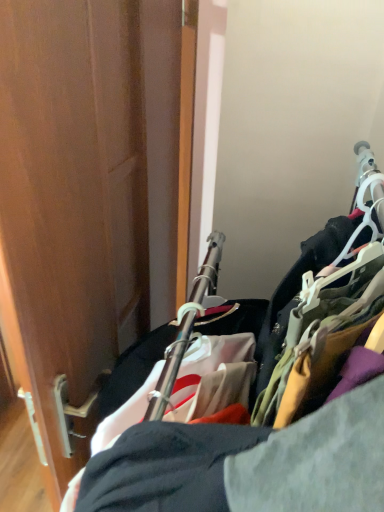
Where is `cloth hangers at right`? cloth hangers at right is located at coordinates (252, 375).

Image resolution: width=384 pixels, height=512 pixels. Describe the element at coordinates (252, 375) in the screenshot. I see `cloth hangers at right` at that location.

At what (x,y) coordinates should I click in order to perform the action: click on wooden door at left. Please return your answer as a coordinate pair (x, y). The image size is (384, 512). Looking at the image, I should click on (87, 195).

This screenshot has width=384, height=512. What do you see at coordinates (87, 195) in the screenshot? I see `wooden door at left` at bounding box center [87, 195].

Locate an element on the screen. cloth hangers at right is located at coordinates (252, 375).

Which is more to the right, cloth hangers at right or wooden door at left?

cloth hangers at right.

Does cloth hangers at right lie behind wooden door at left?

No, it is in front of wooden door at left.

Does point (351, 340) come in front of point (39, 295)?

Yes, point (351, 340) is in front of point (39, 295).

Looking at this image, from the image's perspective, is cloth hangers at right over wooden door at left?

No, from the image's perspective, cloth hangers at right is not over wooden door at left.

Consider the image. From a real-world perspective, is cloth hangers at right physically located above or below wooden door at left?

cloth hangers at right is situated lower than wooden door at left in the real world.

From the picture: Does cloth hangers at right have a greater width compared to wooden door at left?

Correct, the width of cloth hangers at right exceeds that of wooden door at left.

Which of these two, cloth hangers at right or wooden door at left, stands shorter?

wooden door at left is shorter.

Can you confirm if cloth hangers at right is smaller than wooden door at left?

No, cloth hangers at right is not smaller than wooden door at left.

Is wooden door at left surrounded by cloth hangers at right?

Definitely not — wooden door at left is not inside cloth hangers at right.

Are cloth hangers at right and wooden door at left far apart?

No, there isn't a large distance between cloth hangers at right and wooden door at left.

Could you tell me if cloth hangers at right is turned towards wooden door at left?

Yes.

How many degrees apart are the facing directions of cloth hangers at right and wooden door at left?

1.4 degrees separate the facing orientations of cloth hangers at right and wooden door at left.

Measure the distance from cloth hangers at right to wooden door at left.

They are 13.96 inches apart.

Identify the location of door above the cloth hangers at right (from the image's perspective). Image resolution: width=384 pixels, height=512 pixels. (87, 195).

Is wooden door at left to the right of cloth hangers at right from the viewer's perspective?

No, wooden door at left is not to the right of cloth hangers at right.

Is the depth of wooden door at left less than that of cloth hangers at right?

No, the depth of wooden door at left is greater than that of cloth hangers at right.

Between point (46, 255) and point (266, 390), which one is positioned in front?

The point (266, 390) is in front.

From the picture: From the image's perspective, which one is positioned higher, wooden door at left or cloth hangers at right?

wooden door at left appears higher in the image.

From a real-world perspective, who is located higher, wooden door at left or cloth hangers at right?

From a 3D spatial view, wooden door at left is above.

In terms of width, does wooden door at left look wider or thinner when compared to cloth hangers at right?

Considering their sizes, wooden door at left looks slimmer than cloth hangers at right.

Can you confirm if wooden door at left is shorter than cloth hangers at right?

Correct, wooden door at left is not as tall as cloth hangers at right.

Based on their sizes in the image, would you say wooden door at left is bigger or smaller than cloth hangers at right?

Considering their sizes, wooden door at left takes up less space than cloth hangers at right.

Is wooden door at left inside the boundaries of cloth hangers at right, or outside?

wooden door at left is located beyond the bounds of cloth hangers at right.

Based on the photo, is wooden door at left next to cloth hangers at right and touching it?

No, wooden door at left is not with cloth hangers at right.

Is wooden door at left aimed at cloth hangers at right?

No.

Can you tell me how much wooden door at left and cloth hangers at right differ in facing direction?

1.4 degrees separate the facing orientations of wooden door at left and cloth hangers at right.

At what (x,y) coordinates should I click in order to perform the action: click on door that is above the cloth hangers at right (from a real-world perspective). Please return your answer as a coordinate pair (x, y). The height and width of the screenshot is (512, 384). Looking at the image, I should click on (87, 195).

The image size is (384, 512). Find the location of `door above the cloth hangers at right (from the image's perspective)`. door above the cloth hangers at right (from the image's perspective) is located at coordinates (87, 195).

Locate an element on the screen. This screenshot has width=384, height=512. door above the cloth hangers at right (from a real-world perspective) is located at coordinates (87, 195).